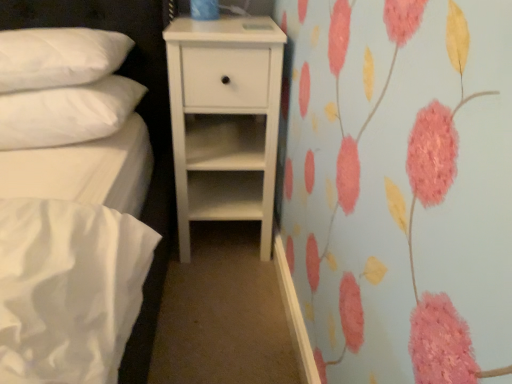
Question: Based on their positions, is white quilted pillow at upper left, the 2th pillow positioned from the bottom, located to the left or right of white matte chest of drawers at center?

Choices:
 (A) right
 (B) left

Answer: (B)

Question: Is point (16, 54) closer or farther from the camera than point (228, 105)?

Choices:
 (A) farther
 (B) closer

Answer: (B)

Question: Which object is the farthest from the white matte chest of drawers at center?

Choices:
 (A) white quilted pillow at upper left, which is the first pillow from top to bottom
 (B) white soft pillow at upper left, marked as the 1th pillow in a bottom-to-top arrangement

Answer: (A)

Question: Which object is positioned farthest from the white soft pillow at upper left, marked as the 1th pillow in a bottom-to-top arrangement?

Choices:
 (A) white matte chest of drawers at center
 (B) white quilted pillow at upper left, which is the first pillow from top to bottom

Answer: (A)